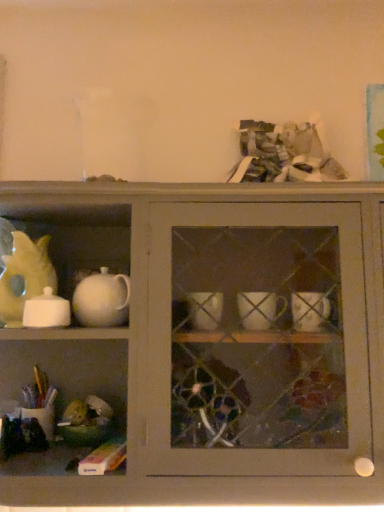
Question: Is white glossy sugar bowl at left taller than white glossy teapot at upper left?

Choices:
 (A) yes
 (B) no

Answer: (B)

Question: From a real-world perspective, is white glossy sugar bowl at left below white glossy teapot at upper left?

Choices:
 (A) yes
 (B) no

Answer: (B)

Question: Is white glossy sugar bowl at left positioned far away from white glossy teapot at upper left?

Choices:
 (A) no
 (B) yes

Answer: (A)

Question: From the image's perspective, is white glossy sugar bowl at left on white glossy teapot at upper left?

Choices:
 (A) yes
 (B) no

Answer: (A)

Question: Is white glossy sugar bowl at left positioned in front of white glossy teapot at upper left?

Choices:
 (A) no
 (B) yes

Answer: (A)

Question: In terms of height, does white glossy teapot at upper left look taller or shorter compared to yellow matte teapot at left?

Choices:
 (A) tall
 (B) short

Answer: (A)

Question: In terms of width, does white glossy teapot at upper left look wider or thinner when compared to yellow matte teapot at left?

Choices:
 (A) thin
 (B) wide

Answer: (B)

Question: Would you say white glossy teapot at upper left is inside or outside yellow matte teapot at left?

Choices:
 (A) outside
 (B) inside

Answer: (A)

Question: Based on their positions, is white glossy teapot at upper left located to the left or right of yellow matte teapot at left?

Choices:
 (A) left
 (B) right

Answer: (B)

Question: From a real-world perspective, is white glossy teapot at upper left physically located above or below white glossy sugar bowl at left?

Choices:
 (A) below
 (B) above

Answer: (A)

Question: From the image's perspective, is white glossy teapot at upper left positioned above or below white glossy sugar bowl at left?

Choices:
 (A) above
 (B) below

Answer: (B)

Question: Based on their positions, is white glossy teapot at upper left located to the left or right of white glossy sugar bowl at left?

Choices:
 (A) right
 (B) left

Answer: (A)

Question: Which is correct: white glossy teapot at upper left is inside white glossy sugar bowl at left, or outside of it?

Choices:
 (A) inside
 (B) outside

Answer: (B)

Question: Considering the positions of white glossy sugar bowl at left and yellow matte teapot at left in the image, is white glossy sugar bowl at left bigger or smaller than yellow matte teapot at left?

Choices:
 (A) small
 (B) big

Answer: (A)

Question: Considering the positions of white glossy sugar bowl at left and yellow matte teapot at left in the image, is white glossy sugar bowl at left taller or shorter than yellow matte teapot at left?

Choices:
 (A) short
 (B) tall

Answer: (A)